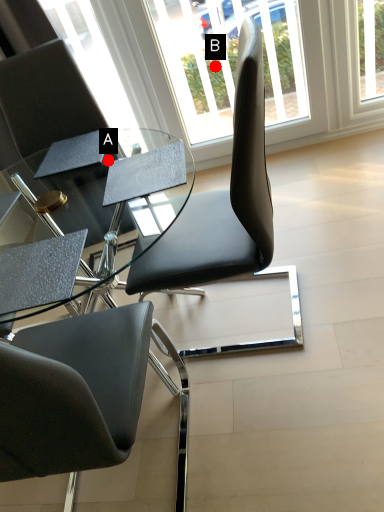
Question: Two points are circled on the image, labeled by A and B beside each circle. Which point is further to the camera?

Choices:
 (A) A is further
 (B) B is further

Answer: (B)